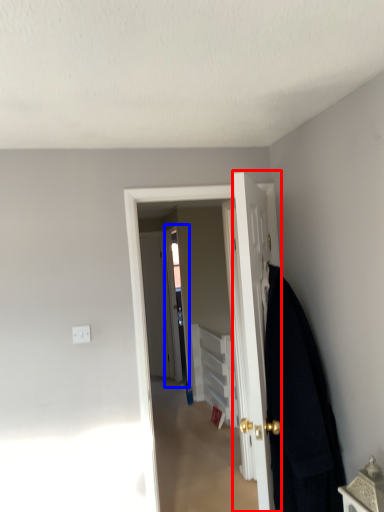
Question: Which point is further to the camera, door (highlighted by a red box) or screen door (highlighted by a blue box)?

Choices:
 (A) door
 (B) screen door

Answer: (B)